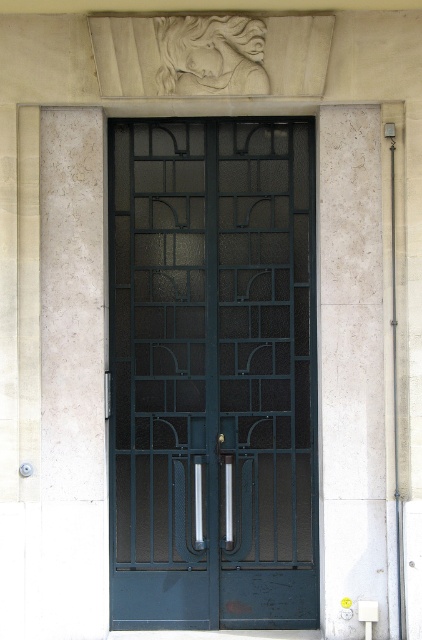
You are an architect designing a new building and want to ensure proper proportions between the dark blue glass door at center and the white marble pillar at left. Based on the image, which one is shorter?

The dark blue glass door at center is shorter than the white marble pillar at left.